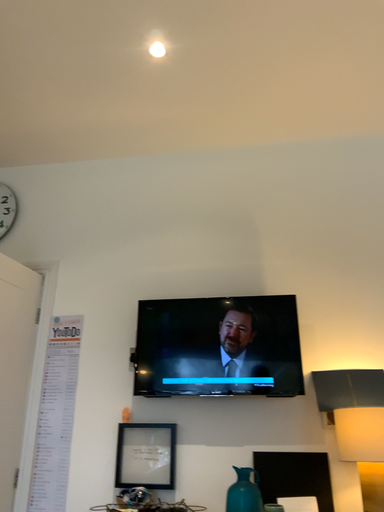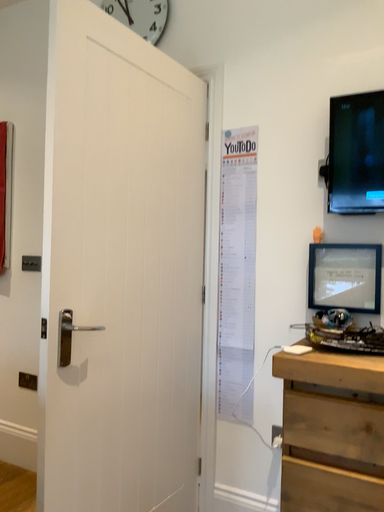
Question: How did the camera likely rotate when shooting the video?

Choices:
 (A) rotated right
 (B) rotated left

Answer: (B)